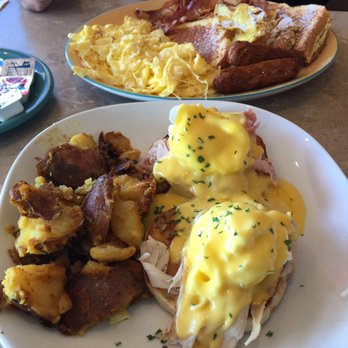
The width and height of the screenshot is (348, 348). Find the location of `crumb`. crumb is located at coordinates (157, 331), (278, 334), (306, 283), (308, 235), (123, 338), (151, 335), (167, 344).